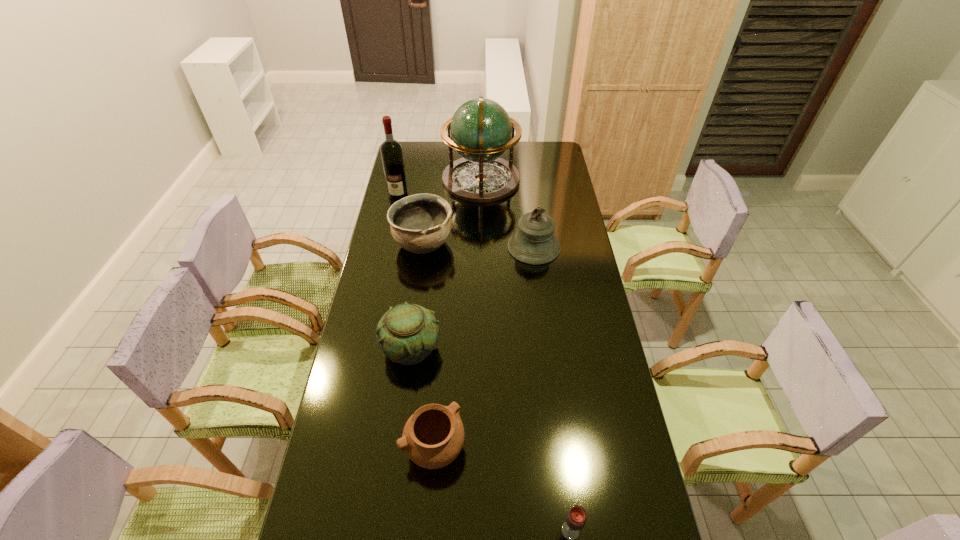
The width and height of the screenshot is (960, 540). In order to click on free space at the far right corner in this screenshot , I will do `click(550, 152)`.

Locate an element on the screen. The height and width of the screenshot is (540, 960). free point between the farthest pottery and the bell is located at coordinates (478, 245).

Where is `free space between the second farthest pottery and the alcohol`? free space between the second farthest pottery and the alcohol is located at coordinates (405, 272).

You are a GUI agent. You are given a task and a screenshot of the screen. Output one action in this format:
    pyautogui.click(x=<x>, y=<y>)
    Task: Click on the empty location between the shortest pottery and the fifth farthest object
    This screenshot has height=540, width=960.
    Given the screenshot: What is the action you would take?
    pyautogui.click(x=422, y=398)

Identify the location of vacant area that lies between the bell and the globe. The width and height of the screenshot is (960, 540). (508, 213).

This screenshot has width=960, height=540. What are the coordinates of `vacant area that lies between the fifth shortest object and the alcohol` in the screenshot? It's located at (467, 221).

At what (x,y) coordinates should I click in order to perform the action: click on free space between the shortest pottery and the globe. Please return your answer as a coordinate pair (x, y). Looking at the image, I should click on (458, 314).

Image resolution: width=960 pixels, height=540 pixels. Identify the location of empty space that is in between the globe and the farthest pottery. (452, 212).

Find the location of a particular element. vacant area between the bell and the alcohol is located at coordinates pyautogui.click(x=467, y=221).

Locate an element on the screen. This screenshot has width=960, height=540. object that is the third closest to the globe is located at coordinates (534, 243).